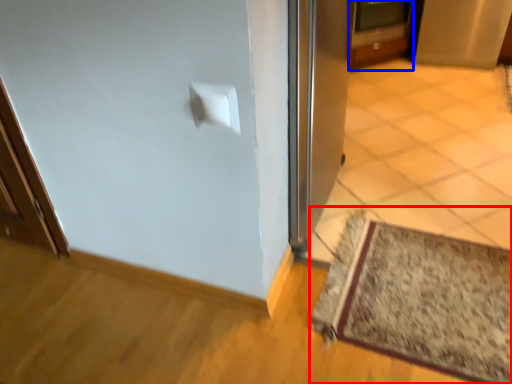
Question: Among these objects, which one is farthest to the camera, mat (highlighted by a red box) or door (highlighted by a blue box)?

Choices:
 (A) mat
 (B) door

Answer: (B)